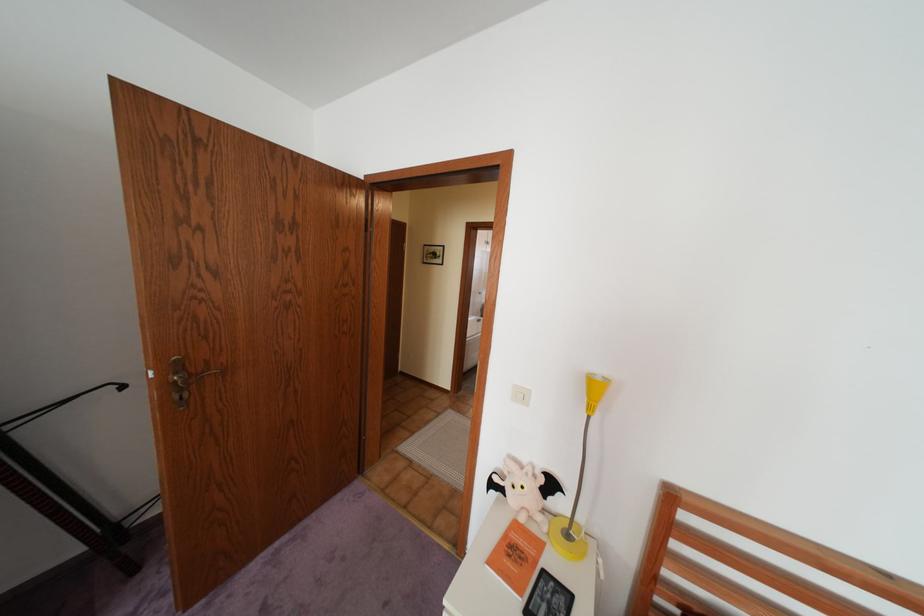
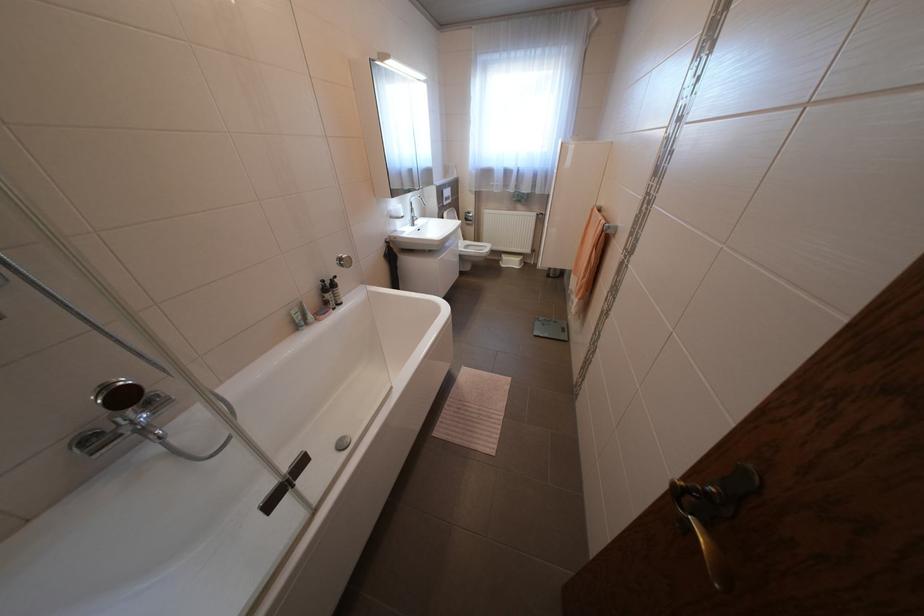
Question: The images are taken continuously from a first-person perspective. In which direction are you moving?

Choices:
 (A) Left
 (B) Right
 (C) Forward
 (D) Backward

Answer: (C)